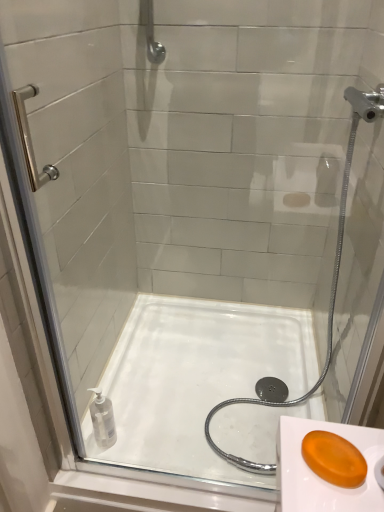
Question: From the image's perspective, is transparent plastic bottle at lower left positioned above or below white glossy bath at center?

Choices:
 (A) above
 (B) below

Answer: (B)

Question: Is transparent plastic bottle at lower left spatially inside white glossy bath at center, or outside of it?

Choices:
 (A) inside
 (B) outside

Answer: (B)

Question: Which of these objects is positioned closest to the brushed metal shower handle at upper center?

Choices:
 (A) transparent plastic bottle at lower left
 (B) white glossy bath at center
 (C) orange translucent soap at lower right

Answer: (B)

Question: Which is farther from the orange translucent soap at lower right?

Choices:
 (A) transparent plastic bottle at lower left
 (B) brushed metal shower handle at upper center
 (C) white glossy bath at center

Answer: (B)